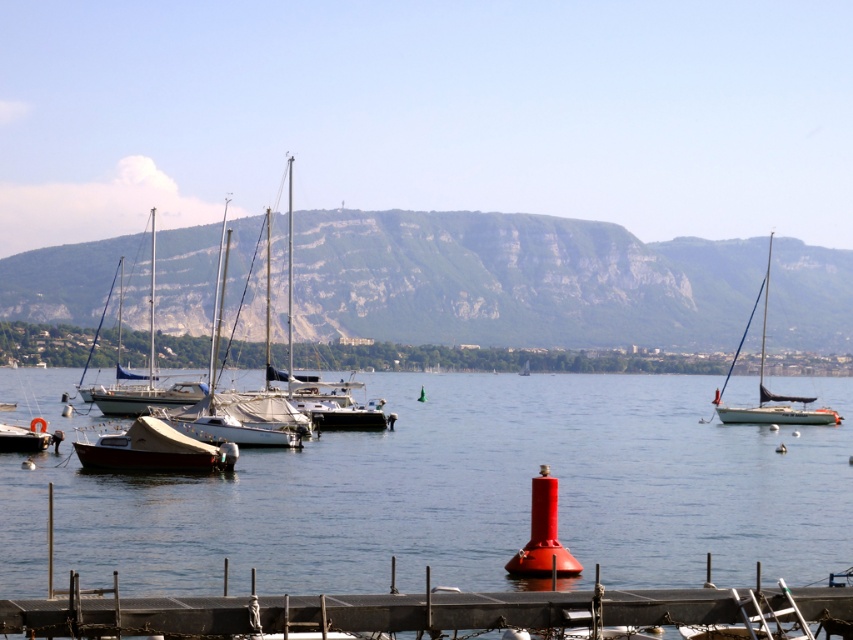
Question: Which of the following is the closest to the observer?

Choices:
 (A) (724, 419)
 (B) (30, 444)

Answer: (B)

Question: Which point is farther to the camera?

Choices:
 (A) [187, 458]
 (B) [637, 609]

Answer: (A)

Question: Is transparent water at center closer to camera compared to white matte sailboat at center?

Choices:
 (A) yes
 (B) no

Answer: (A)

Question: Does smooth wood dock at lower center have a larger size compared to white matte sailboat at left?

Choices:
 (A) no
 (B) yes

Answer: (A)

Question: From the image, what is the correct spatial relationship of transparent water at center in relation to white matte sailboat at center?

Choices:
 (A) left
 (B) right

Answer: (A)

Question: Which object is farther from the camera taking this photo?

Choices:
 (A) white matte sailboat at right
 (B) white matte sailboat at center

Answer: (B)